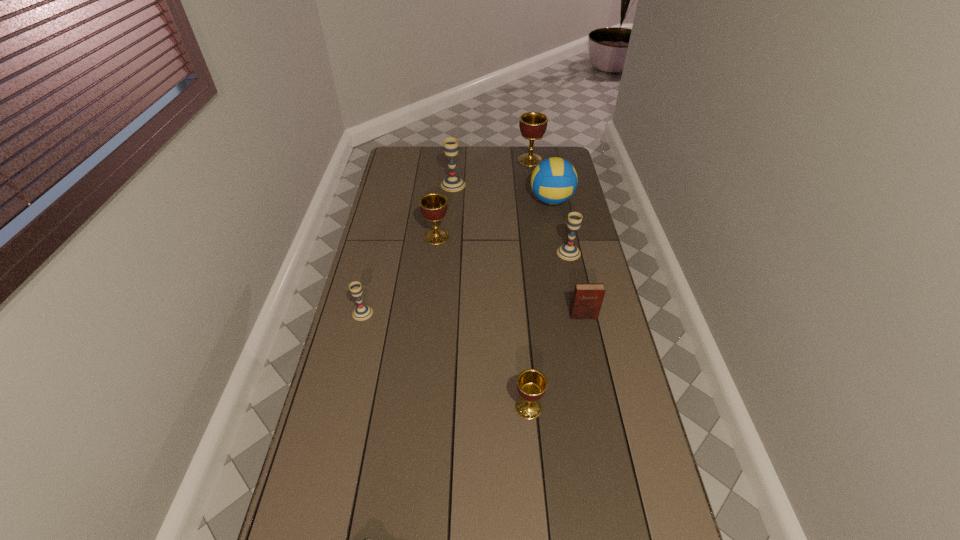
Locate an element on the screen. The image size is (960, 540). vacant area at the far left corner of the desktop is located at coordinates (407, 161).

Locate an element on the screen. free spot between the blue volleyball and the second smallest golden chalice is located at coordinates (494, 219).

I want to click on unoccupied position between the farthest gray chalice and the diary, so click(518, 251).

At what (x,y) coordinates should I click in order to perform the action: click on free space that is in between the nearest golden chalice and the leftmost golden chalice. Please return your answer as a coordinate pair (x, y). The width and height of the screenshot is (960, 540). Looking at the image, I should click on (483, 322).

I want to click on vacant area that lies between the second biggest gray chalice and the leftmost golden chalice, so click(503, 245).

Where is `vacant space that is in between the second farthest golden chalice and the second nearest gray chalice`? vacant space that is in between the second farthest golden chalice and the second nearest gray chalice is located at coordinates (503, 245).

Find the location of a particular element. empty location between the rightmost gray chalice and the reddish-brown diary is located at coordinates (576, 284).

Find the location of a particular element. This screenshot has width=960, height=540. free space between the biggest gray chalice and the biggest golden chalice is located at coordinates [x=492, y=172].

At what (x,y) coordinates should I click in order to perform the action: click on the seventh closest object to the volleyball. Please return your answer as a coordinate pair (x, y). The height and width of the screenshot is (540, 960). Looking at the image, I should click on (531, 384).

Identify which object is located as the nearest to the second nearest gray chalice. Please provide its 2D coordinates. Your answer should be formatted as a tuple, i.e. [(x, y)], where the tuple contains the x and y coordinates of a point satisfying the conditions above.

[(554, 180)]